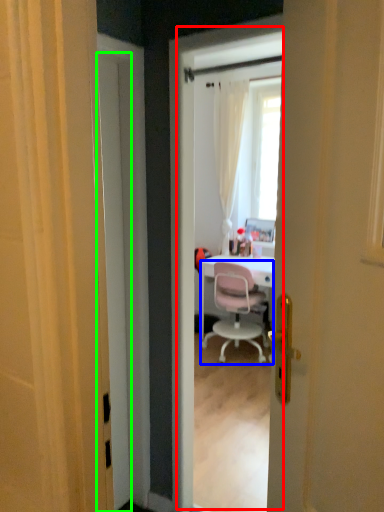
Question: Which object is positioned farthest from screen door (highlighted by a red box)? Select from chair (highlighted by a blue box) and door (highlighted by a green box).

Choices:
 (A) chair
 (B) door

Answer: (B)